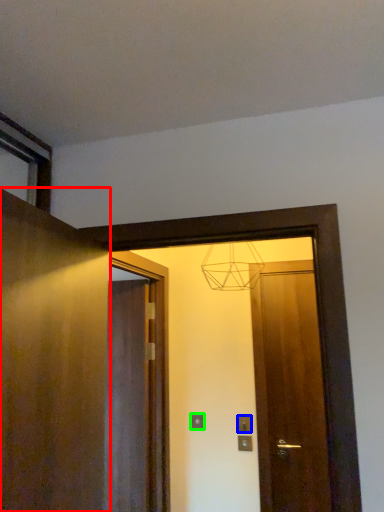
Question: Which object is positioned farthest from door (highlighted by a red box)? Select from electric outlet (highlighted by a blue box) and electric outlet (highlighted by a green box).

Choices:
 (A) electric outlet
 (B) electric outlet

Answer: (A)